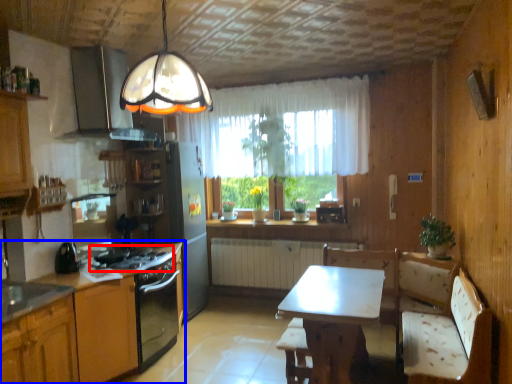
Question: Which object is closer to the camera taking this photo, gas stove (highlighted by a red box) or cabinetry (highlighted by a blue box)?

Choices:
 (A) gas stove
 (B) cabinetry

Answer: (B)